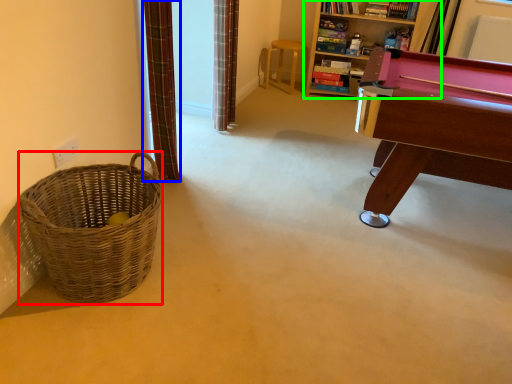
Question: Considering the real-world distances, which object is farthest from basket (highlighted by a red box)? curtain (highlighted by a blue box) or bookcase (highlighted by a green box)?

Choices:
 (A) curtain
 (B) bookcase

Answer: (B)